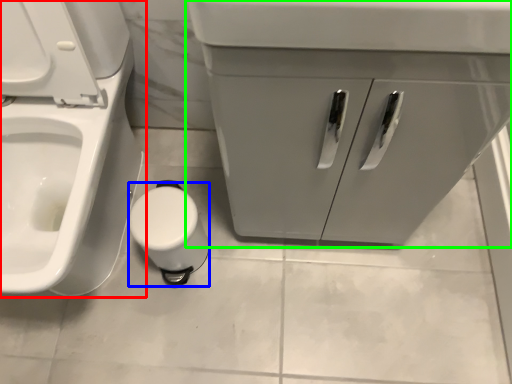
Question: Estimate the real-world distances between objects in this image. Which object is farther from toilet (highlighted by a red box), toilet paper (highlighted by a blue box) or bathroom cabinet (highlighted by a green box)?

Choices:
 (A) toilet paper
 (B) bathroom cabinet

Answer: (B)